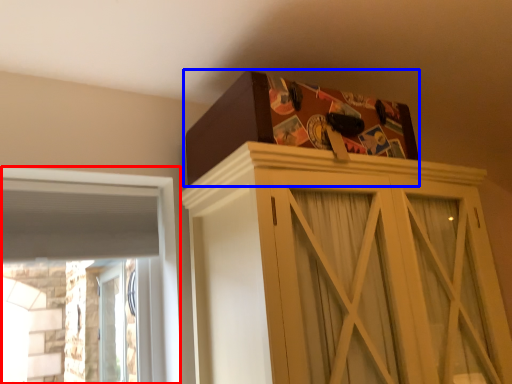
Question: Among these objects, which one is farthest to the camera, window (highlighted by a red box) or cardboard box (highlighted by a blue box)?

Choices:
 (A) window
 (B) cardboard box

Answer: (A)